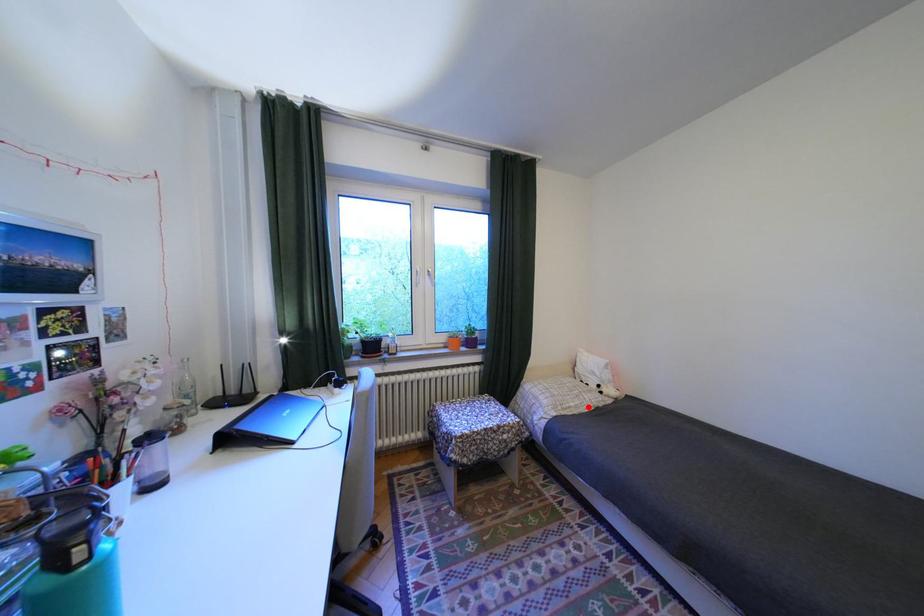
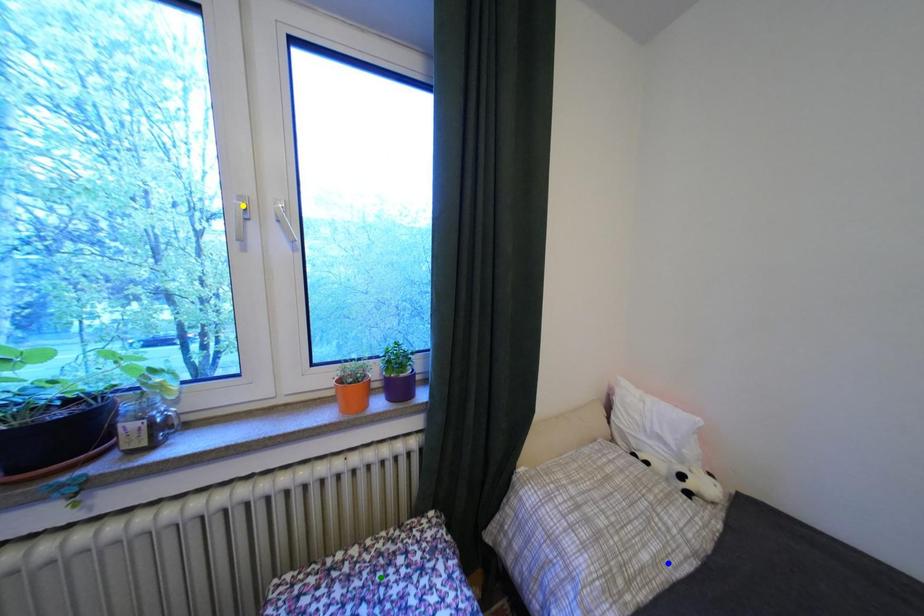
Question: I am providing you with two images of the same scene from different viewpoints. A red point is marked on the first image. You are given multiple points on the second image. Can you choose the point in image 2 that corresponds to the point in image 1?

Choices:
 (A) green point
 (B) yellow point
 (C) blue point

Answer: (C)